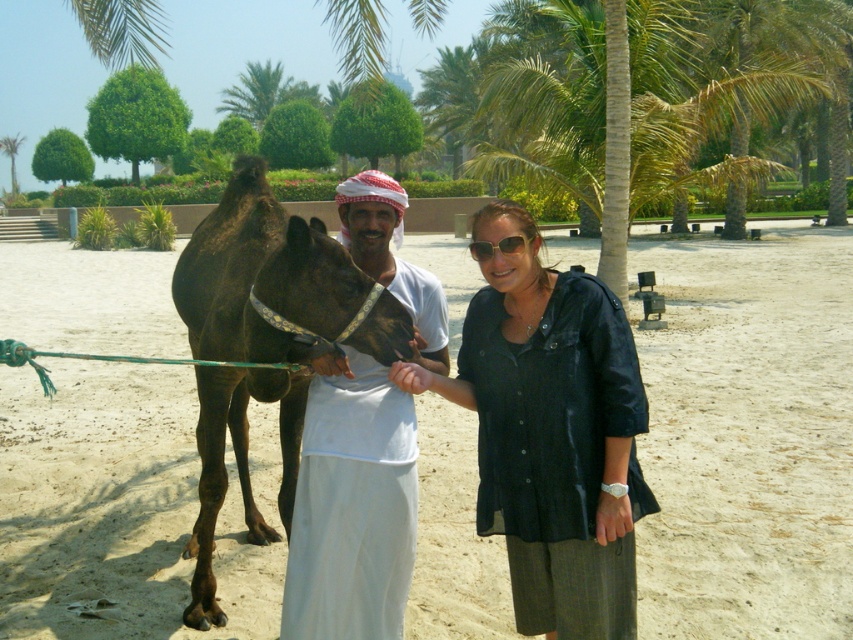
Can you confirm if green leafy palm tree at center is positioned to the left of white cotton shirt at center?

No, green leafy palm tree at center is not to the left of white cotton shirt at center.

In order to click on green leafy palm tree at center in this screenshot , I will do `click(641, 99)`.

Is green leafy palm tree at upper center shorter than green leafy palm tree at upper left?

Yes, green leafy palm tree at upper center is shorter than green leafy palm tree at upper left.

Does point (254, 122) come in front of point (19, 140)?

Yes, it is in front of point (19, 140).

Identify the location of green leafy palm tree at upper center. This screenshot has width=853, height=640. (257, 92).

Find the location of a particular element. white cotton shirt at center is located at coordinates (352, 506).

Does white cotton shirt at center have a greater width compared to green leafy palm tree at upper left?

Incorrect, white cotton shirt at center's width does not surpass green leafy palm tree at upper left's.

Identify the location of white cotton shirt at center. [352, 506].

You are a GUI agent. You are given a task and a screenshot of the screen. Output one action in this format:
    pyautogui.click(x=<x>, y=<y>)
    Task: Click on the white cotton shirt at center
    Image resolution: width=853 pixels, height=640 pixels.
    Given the screenshot: What is the action you would take?
    pyautogui.click(x=352, y=506)